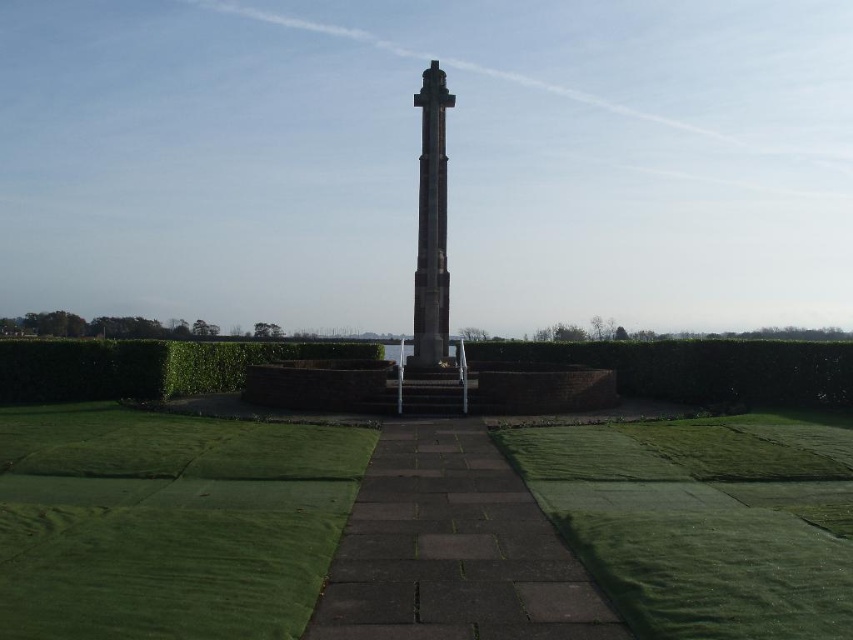
Can you confirm if green hedge at center is positioned to the right of green hedge at lower left?

Yes, green hedge at center is to the right of green hedge at lower left.

Is point (718, 342) positioned after point (259, 356)?

That is False.

Who is more forward, (701, 369) or (236, 362)?

Point (701, 369) is in front.

Locate an element on the screen. Image resolution: width=853 pixels, height=640 pixels. green hedge at center is located at coordinates (700, 369).

From the picture: Can you confirm if green turf at lower right is shorter than green hedge at center?

Indeed, green turf at lower right has a lesser height compared to green hedge at center.

Between green turf at lower right and green hedge at center, which one has less height?

Standing shorter between the two is green turf at lower right.

Between point (834, 560) and point (740, 362), which one is positioned in front?

Positioned in front is point (834, 560).

Identify the location of green turf at lower right. The width and height of the screenshot is (853, 640). (703, 520).

Is point (38, 568) farther from viewer compared to point (778, 394)?

No, it is in front of (778, 394).

Can you confirm if green grass at lower left is positioned to the left of green hedge at center?

Indeed, green grass at lower left is positioned on the left side of green hedge at center.

Does point (169, 426) come closer to viewer compared to point (624, 378)?

Yes, point (169, 426) is in front of point (624, 378).

You are a GUI agent. You are given a task and a screenshot of the screen. Output one action in this format:
    pyautogui.click(x=<x>, y=<y>)
    Task: Click on the green grass at lower left
    
    Given the screenshot: What is the action you would take?
    pyautogui.click(x=166, y=522)